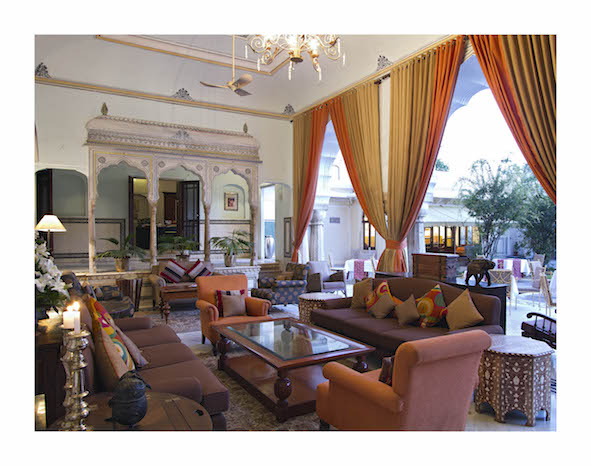
Where is `brown sofas`? The height and width of the screenshot is (466, 591). brown sofas is located at coordinates (168, 350), (385, 329).